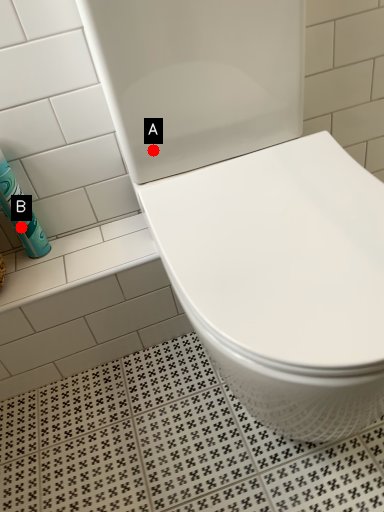
Question: Two points are circled on the image, labeled by A and B beside each circle. Which point is farther from the camera taking this photo?

Choices:
 (A) A is further
 (B) B is further

Answer: (B)